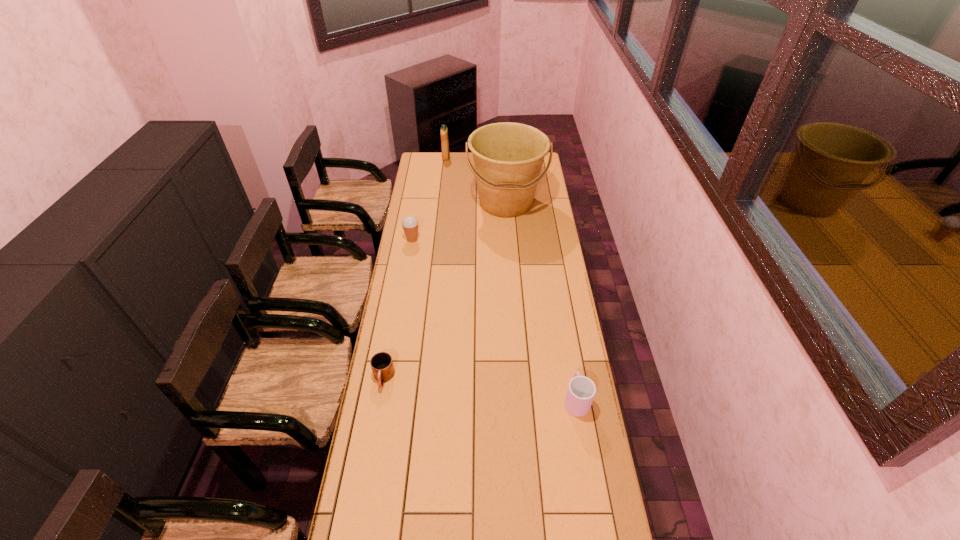
Find the location of a particular element. vacant space that is in between the second farthest object and the shortest object is located at coordinates (444, 290).

Where is `vacant space that's between the icecream and the shortest object`? The height and width of the screenshot is (540, 960). vacant space that's between the icecream and the shortest object is located at coordinates (397, 309).

Locate an element on the screen. This screenshot has height=540, width=960. free point between the shortest object and the farthest object is located at coordinates (415, 268).

Image resolution: width=960 pixels, height=540 pixels. What are the coordinates of `vacant area that lies between the third nearest object and the detergent` in the screenshot? It's located at (429, 199).

Select which object is the third closest to the mug. Please provide its 2D coordinates. Your answer should be formatted as a tuple, i.e. [(x, y)], where the tuple contains the x and y coordinates of a point satisfying the conditions above.

[(508, 157)]

This screenshot has height=540, width=960. In order to click on object that is the fourth closest to the cup in this screenshot , I will do point(444,131).

Locate an element on the screen. Image resolution: width=960 pixels, height=540 pixels. free spot that satisfies the following two spatial constraints: 1. on the label of the third object from right to left; 2. with the handle on the side of the second shortest object is located at coordinates (420, 400).

Find the location of a particular element. vacant space that satisfies the following two spatial constraints: 1. on the label of the detergent; 2. on the side of the shortest object with the handle is located at coordinates (422, 378).